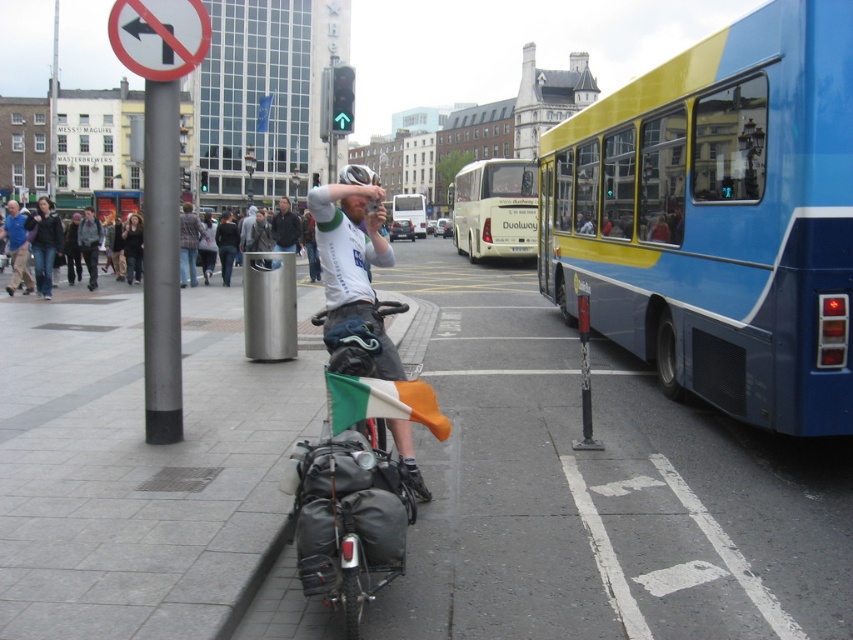
You are a delivery person on a bicycle in the scene. You need to place a package on the ground near the white fabric shirt at center and the brushed metal trash can at center. Can you fit the package between them if it requires 8 feet of space?

The distance between the white fabric shirt at center and the brushed metal trash can at center is 7.63 feet, which is less than the required 8 feet. Therefore, the package cannot be placed between them.